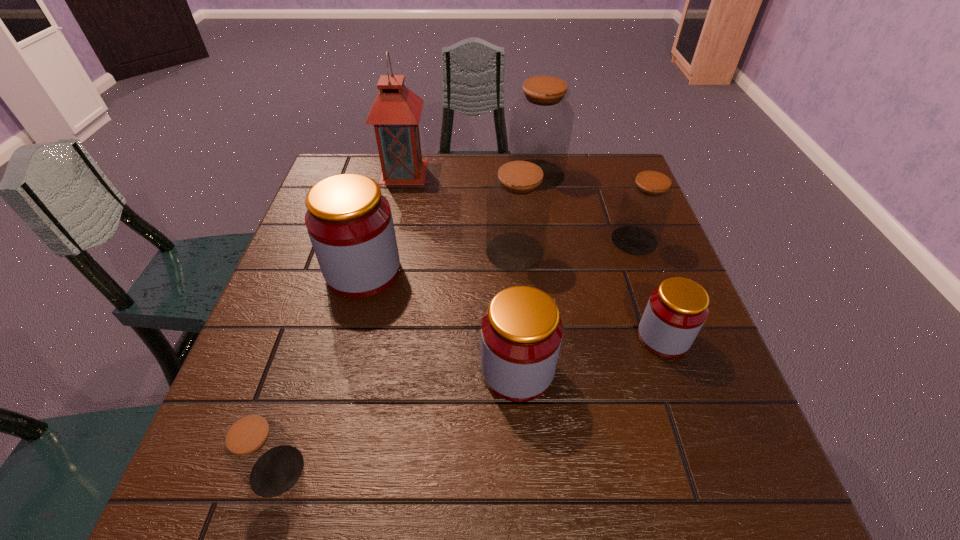
The height and width of the screenshot is (540, 960). In order to click on the leftmost brown jar in this screenshot , I will do `click(259, 450)`.

Identify the location of the nearest jar. Image resolution: width=960 pixels, height=540 pixels. (259, 450).

I want to click on free region located on the right of the tallest object, so click(x=497, y=172).

Find the location of `blank space located on the left of the tallest jar`. blank space located on the left of the tallest jar is located at coordinates (488, 174).

Identify the location of free point located 0.260m on the back of the third smallest brown jar. The height and width of the screenshot is (540, 960). (509, 176).

What are the coordinates of `vacant space located on the left of the biggest red jar` in the screenshot? It's located at (297, 272).

Find the location of a particular element. Image resolution: width=960 pixels, height=540 pixels. free space located 0.160m on the left of the rightmost brown jar is located at coordinates (548, 240).

Where is `vacant region located on the left of the second red jar from left to right`? The height and width of the screenshot is (540, 960). vacant region located on the left of the second red jar from left to right is located at coordinates pos(310,370).

This screenshot has width=960, height=540. I want to click on free point located 0.380m on the back of the rightmost red jar, so click(618, 208).

The height and width of the screenshot is (540, 960). I want to click on vacant area located on the back of the smallest brown jar, so [297, 407].